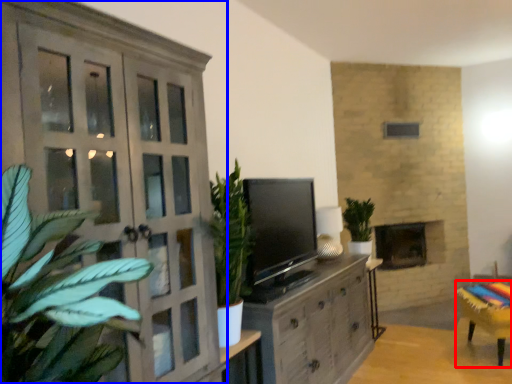
Question: Which object is closer to the camera taking this photo, furniture (highlighted by a red box) or cupboard (highlighted by a blue box)?

Choices:
 (A) furniture
 (B) cupboard

Answer: (B)